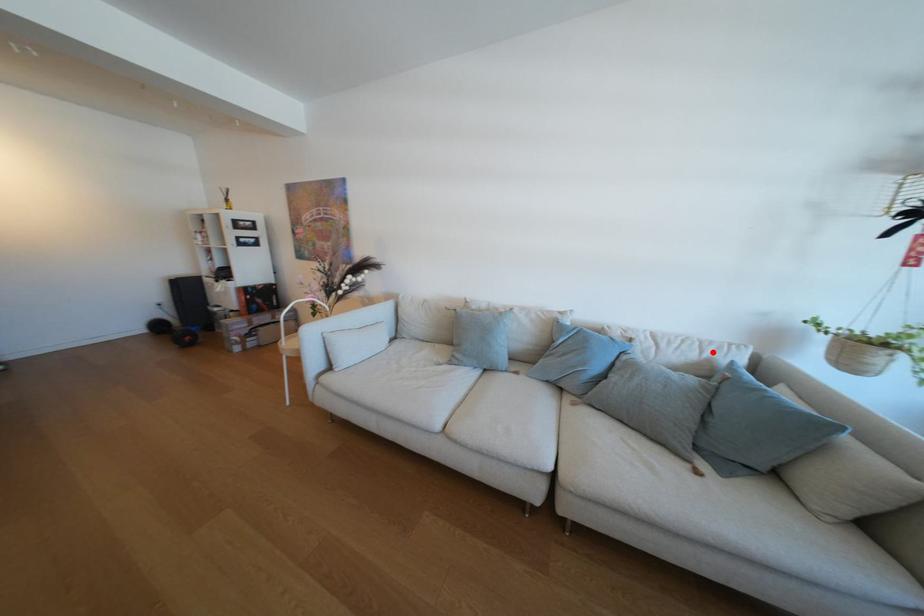
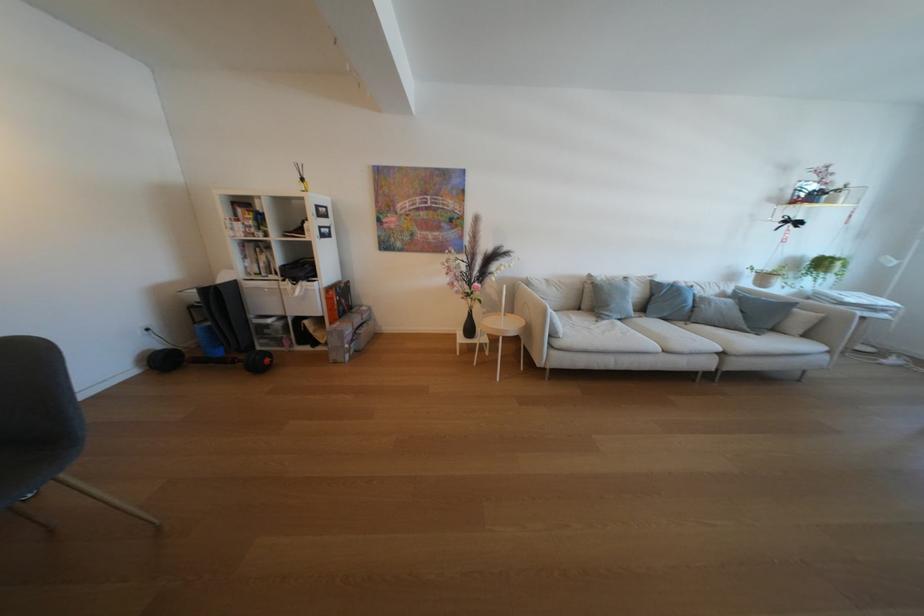
Locate, in the second image, the point that corresponds to the highlighted location in the first image.

(730, 289)